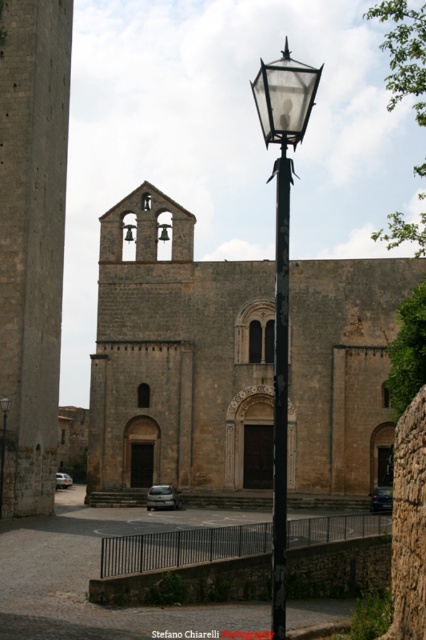
Question: Is brown stone church at center further to the viewer compared to silver metallic car at center?

Choices:
 (A) no
 (B) yes

Answer: (A)

Question: Can you confirm if silver metallic van at center is positioned below metallic bell at center?

Choices:
 (A) no
 (B) yes

Answer: (B)

Question: Which point is farther from the camera taking this photo?

Choices:
 (A) (2, 403)
 (B) (161, 499)
 (C) (385, 490)
 (D) (60, 483)

Answer: (D)

Question: Estimate the real-world distances between objects in this image. Which object is closer to the silver metallic car at center?

Choices:
 (A) metallic bell at center
 (B) metallic gray sedan at center
 (C) matte black street light at center

Answer: (C)

Question: Can you confirm if brown stone church at center is positioned below metallic gray sedan at center?

Choices:
 (A) no
 (B) yes

Answer: (A)

Question: Considering the real-world distances, which object is farthest from the brown stone church at center?

Choices:
 (A) silver metallic van at center
 (B) black glass street light at center

Answer: (A)